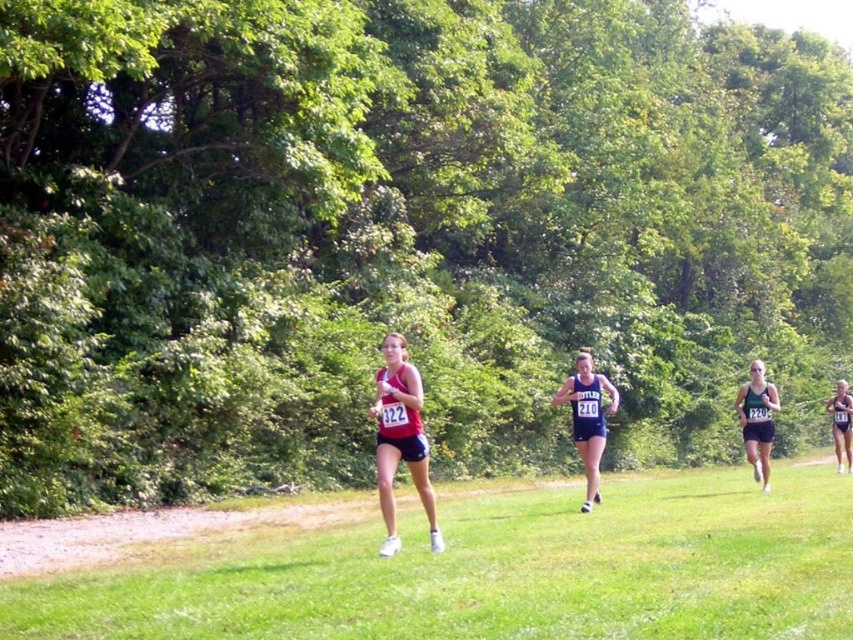
Is point (207, 625) positioned behind point (749, 429)?

That is False.

Can you confirm if green grass at center is taller than black athletic wear at right?

Incorrect, green grass at center's height is not larger of black athletic wear at right's.

Locate an element on the screen. The height and width of the screenshot is (640, 853). green grass at center is located at coordinates (495, 572).

Is green grass at center above blue athletic uniform at center?

Incorrect, green grass at center is not positioned above blue athletic uniform at center.

Does green grass at center have a greater height compared to blue athletic uniform at center?

Yes, green grass at center is taller than blue athletic uniform at center.

Is point (485, 612) farther from camera compared to point (590, 412)?

No, (485, 612) is in front of (590, 412).

Identify the location of green grass at center. The height and width of the screenshot is (640, 853). (495, 572).

The height and width of the screenshot is (640, 853). Describe the element at coordinates (399, 438) in the screenshot. I see `matte red tank top at center` at that location.

Describe the element at coordinates (399, 438) in the screenshot. I see `matte red tank top at center` at that location.

The image size is (853, 640). Find the location of `matte red tank top at center`. matte red tank top at center is located at coordinates (399, 438).